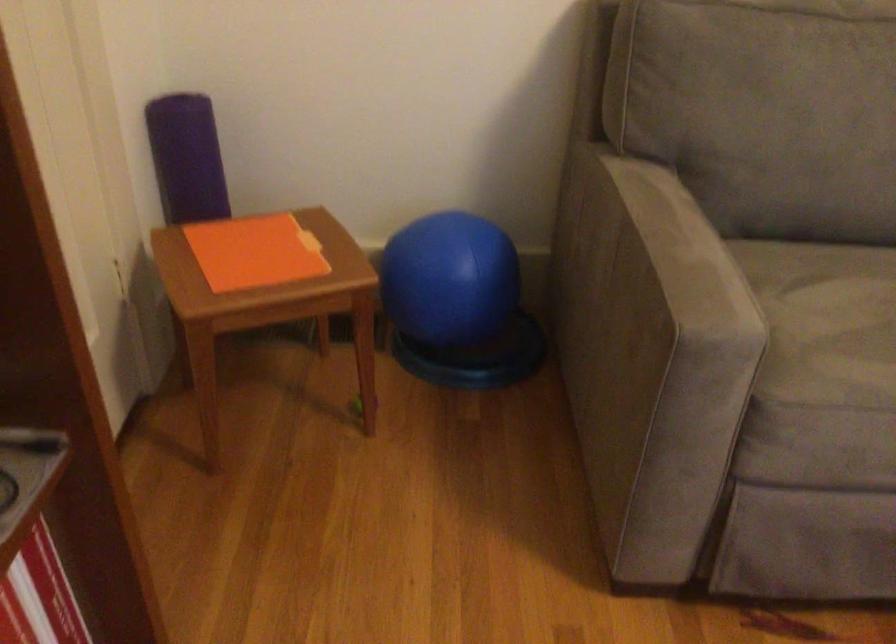
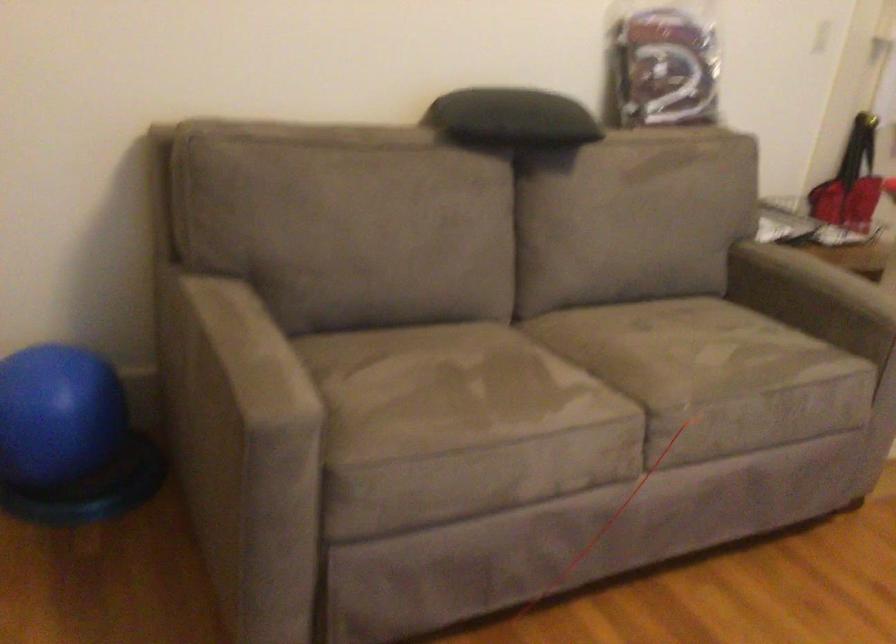
Question: The images are taken continuously from a first-person perspective. In which direction is your viewpoint rotating?

Choices:
 (A) Left
 (B) Right
 (C) Up
 (D) Down

Answer: (B)